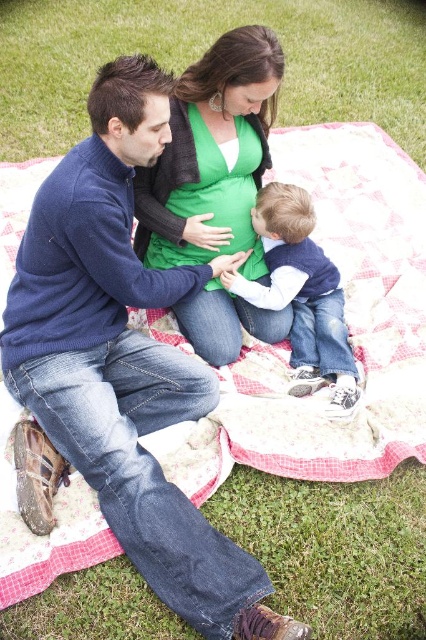
Question: Where is green grass at center located in relation to denim jeans at center in the image?

Choices:
 (A) left
 (B) right

Answer: (A)

Question: Is blue cotton sweater at center smaller than green matte sweater at center?

Choices:
 (A) no
 (B) yes

Answer: (A)

Question: Based on their relative distances, which object is farther from the blue cotton sweater at center?

Choices:
 (A) green grass at center
 (B) green matte sweater at center
 (C) denim jeans at center

Answer: (A)

Question: Is green matte sweater at center below denim jeans at center?

Choices:
 (A) no
 (B) yes

Answer: (A)

Question: Which of the following is the farthest from the observer?

Choices:
 (A) (376, 74)
 (B) (239, 154)
 (C) (131, 224)

Answer: (A)

Question: Among these objects, which one is farthest from the camera?

Choices:
 (A) blue cotton sweater at center
 (B) green grass at center
 (C) green matte sweater at center

Answer: (B)